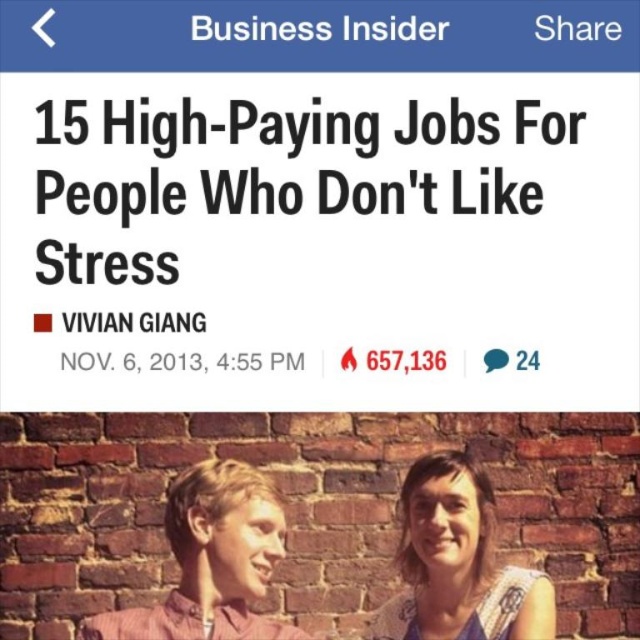
You are viewing this webpage and want to read the article about high paying jobs. Which object is located higher up on the page, the black text at upper center or the blue lace dress at center?

Answer: The black text at upper center is located higher up on the page than the blue lace dress at center.

You are designing a webpage layout and need to ensure that the black text at upper center and the blue lace dress at center are both visible. Given their sizes, which element should you prioritize placing first to maintain visual hierarchy?

The blue lace dress at center should be prioritized since it is larger than the black text at upper center, making it the focal point of the design.

Based on the image of the Business Insider article, which of the two points, point (456, 100) or point (200, 580), is closer to the camera?

Point (200, 580) is closer to the camera than point (456, 100).